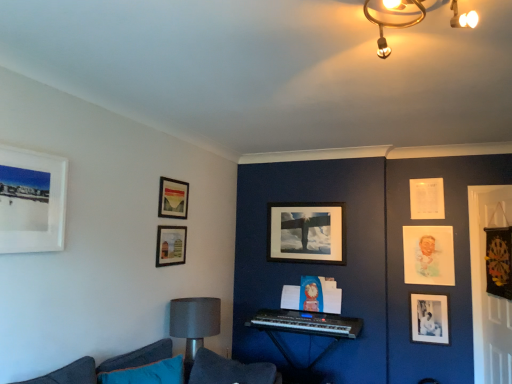
Question: Is velvet black dartboard at right, which is the 7th picture frame in back-to-front order, not within matte wooden picture frame at center, which is the fifth picture frame from right to left?

Choices:
 (A) yes
 (B) no

Answer: (A)

Question: From a real-world perspective, is velvet black dartboard at right, placed as the 2th picture frame when sorted from front to back, over matte wooden picture frame at center, marked as the 8th picture frame in a front-to-back arrangement?

Choices:
 (A) no
 (B) yes

Answer: (A)

Question: Is velvet black dartboard at right, which is the 1th picture frame in right-to-left order, behind matte wooden picture frame at center, the 4th picture frame in the left-to-right sequence?

Choices:
 (A) yes
 (B) no

Answer: (B)

Question: Considering the relative sizes of velvet black dartboard at right, which is the 1th picture frame in right-to-left order, and matte wooden picture frame at center, marked as the 8th picture frame in a front-to-back arrangement, in the image provided, is velvet black dartboard at right, which is the 1th picture frame in right-to-left order, thinner than matte wooden picture frame at center, marked as the 8th picture frame in a front-to-back arrangement,?

Choices:
 (A) yes
 (B) no

Answer: (B)

Question: Is velvet black dartboard at right, placed as the 2th picture frame when sorted from front to back, facing towards matte wooden picture frame at center, the 4th picture frame in the left-to-right sequence?

Choices:
 (A) no
 (B) yes

Answer: (B)

Question: Visually, is pastel paper portrait at right, which appears as the third picture frame when viewed from the back, positioned to the left or to the right of black plastic keyboard at center?

Choices:
 (A) left
 (B) right

Answer: (B)

Question: From the image's perspective, is pastel paper portrait at right, the 6th picture frame from the left, located above or below black plastic keyboard at center?

Choices:
 (A) above
 (B) below

Answer: (A)

Question: From a real-world perspective, is pastel paper portrait at right, which ranks as the third picture frame in right-to-left order, physically located above or below black plastic keyboard at center?

Choices:
 (A) below
 (B) above

Answer: (B)

Question: Does point (406, 261) appear closer or farther from the camera than point (312, 365)?

Choices:
 (A) farther
 (B) closer

Answer: (B)

Question: Looking at the image, does white paper at upper right, which is the 2th picture frame in back-to-front order, seem bigger or smaller compared to matte wooden picture frame at center, which is the fifth picture frame from right to left?

Choices:
 (A) small
 (B) big

Answer: (A)

Question: Considering the positions of white paper at upper right, the 7th picture frame positioned from the front, and matte wooden picture frame at center, the 4th picture frame in the left-to-right sequence, in the image, is white paper at upper right, the 7th picture frame positioned from the front, wider or thinner than matte wooden picture frame at center, the 4th picture frame in the left-to-right sequence,?

Choices:
 (A) thin
 (B) wide

Answer: (A)

Question: Is white paper at upper right, which is the 2th picture frame in back-to-front order, inside or outside of matte wooden picture frame at center, marked as the 8th picture frame in a front-to-back arrangement?

Choices:
 (A) inside
 (B) outside

Answer: (B)

Question: From a real-world perspective, relative to matte wooden picture frame at center, which is the fifth picture frame from right to left, is white paper at upper right, which ranks as the 2th picture frame in right-to-left order, vertically above or below?

Choices:
 (A) below
 (B) above

Answer: (B)

Question: Is point (27, 168) positioned closer to the camera than point (161, 248)?

Choices:
 (A) closer
 (B) farther

Answer: (A)

Question: From a real-world perspective, is white matte picture frame at upper left, which appears as the 8th picture frame when viewed from the right, positioned above or below matte glass picture frame at upper center, acting as the 3th picture frame starting from the front?

Choices:
 (A) below
 (B) above

Answer: (B)